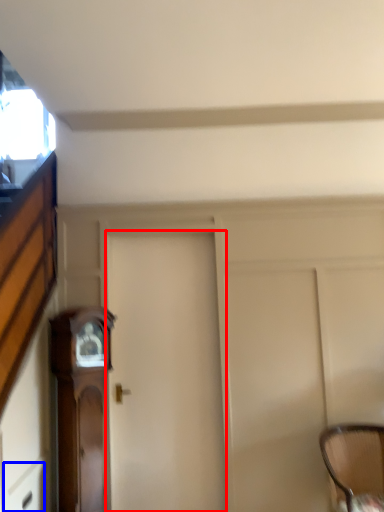
Question: Which object is closer to the camera taking this photo, door (highlighted by a red box) or drawer (highlighted by a blue box)?

Choices:
 (A) door
 (B) drawer

Answer: (B)